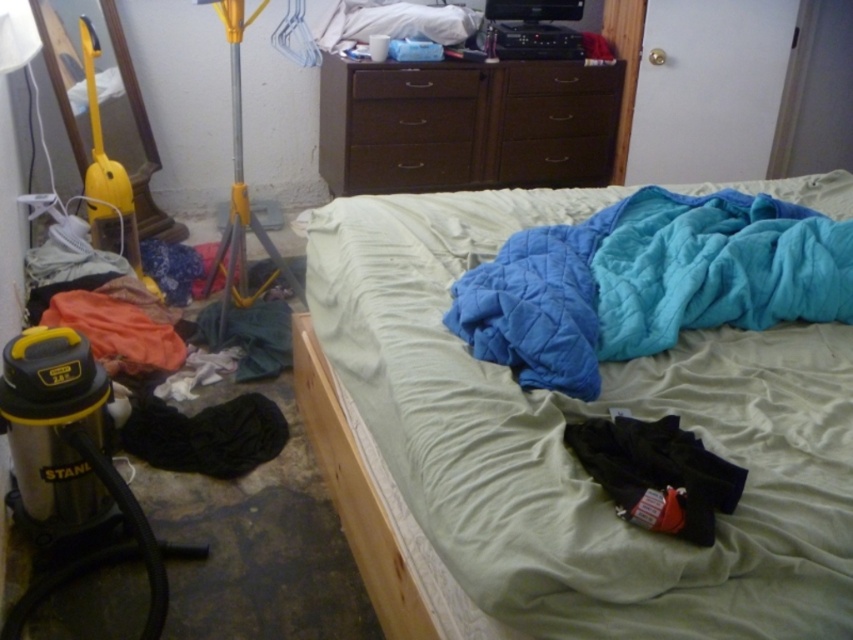
Is quilted fabric bed at center to the right of dark wood dresser at upper center from the viewer's perspective?

Yes, quilted fabric bed at center is to the right of dark wood dresser at upper center.

Can you confirm if quilted fabric bed at center is positioned to the left of dark wood dresser at upper center?

In fact, quilted fabric bed at center is to the right of dark wood dresser at upper center.

Between point (434, 429) and point (595, 122), which one is positioned in front?

Point (434, 429)

You are a GUI agent. You are given a task and a screenshot of the screen. Output one action in this format:
    pyautogui.click(x=<x>, y=<y>)
    Task: Click on the quilted fabric bed at center
    
    Given the screenshot: What is the action you would take?
    pyautogui.click(x=569, y=452)

Is point (566, 492) closer to camera compared to point (611, 433)?

Yes.

This screenshot has width=853, height=640. What do you see at coordinates (569, 452) in the screenshot? I see `quilted fabric bed at center` at bounding box center [569, 452].

The width and height of the screenshot is (853, 640). Identify the location of quilted fabric bed at center. (569, 452).

Which is in front, point (740, 193) or point (672, 432)?

Point (672, 432) is more forward.

Looking at this image, is quilted blue blanket at center shorter than black cotton pants at lower right?

No, quilted blue blanket at center is not shorter than black cotton pants at lower right.

Find the location of a particular element. Image resolution: width=853 pixels, height=640 pixels. quilted blue blanket at center is located at coordinates (647, 282).